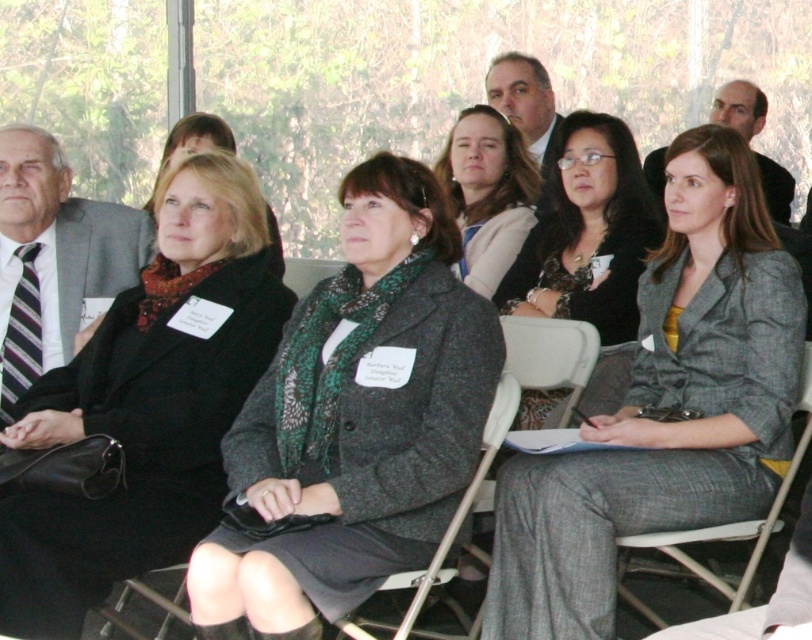
Who is shorter, charcoal wool coat at center or matte black coat at center?

Standing shorter between the two is charcoal wool coat at center.

Which is more to the right, charcoal wool coat at center or matte black coat at center?

charcoal wool coat at center

The image size is (812, 640). Describe the element at coordinates (356, 419) in the screenshot. I see `charcoal wool coat at center` at that location.

Locate an element on the screen. The height and width of the screenshot is (640, 812). charcoal wool coat at center is located at coordinates (356, 419).

Is point (463, 266) positioned behind point (191, 154)?

Yes, point (463, 266) is farther from viewer.

Consider the image. Who is positioned more to the left, matte gray blazer at center or matte black scarf at center?

Positioned to the left is matte black scarf at center.

Between point (495, 275) and point (268, 236), which one is positioned behind?

The point (495, 275) is more distant.

The width and height of the screenshot is (812, 640). What are the coordinates of `matte gray blazer at center` in the screenshot? It's located at (487, 193).

Between point (258, 419) and point (718, 582), which one is positioned behind?

The point (718, 582) is more distant.

Is charcoal wool coat at center to the left of gray fabric chair at lower right from the viewer's perspective?

Yes, charcoal wool coat at center is to the left of gray fabric chair at lower right.

Is point (339, 298) in front of point (788, 484)?

No, it is not.

Where is `charcoal wool coat at center`? This screenshot has height=640, width=812. charcoal wool coat at center is located at coordinates (356, 419).